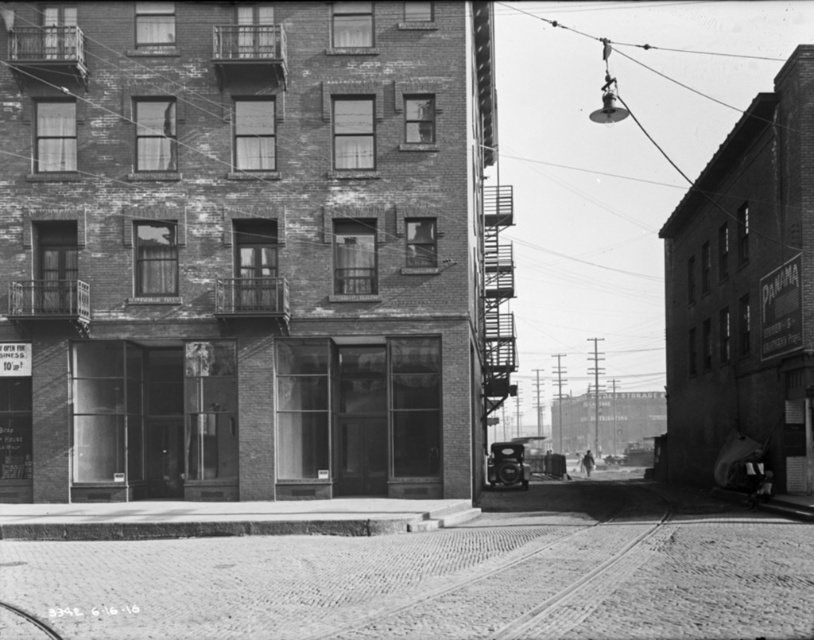
You are a pedestrian standing on the sidewalk in the image. You notice a metallic car at center located at point (506,465). Is there any obstruction between you and the metallic car at center?

The metallic car at center is located at point (506,465), which is the center of the image. Since the street in front of the building is paved with cobblestones and tram tracks run parallel to the sidewalk, there might be tram tracks between you and the metallic car at center. However, the description does not mention any other objects obstructing the path, so it is possible that there is no obstruction besides the tram tracks. But since tram tracks are part of the street infrastructure, they are not ob

You are standing at the point with coordinates point (589, 452) and want to walk to the point with coordinates point (523, 470). Which direction should you face to move towards your destination?

You should face towards the direction of the point (523, 470), which is in front of point (589, 452), so you need to move forward in that direction.

You are a city planner reviewing this historical image for a preservation project. You need to determine if the metallic car at center can be moved past the dark gray fabric man at center without any adjustments. Based on their sizes, can the car be moved around the man?

The metallic car at center occupies less space than the dark gray fabric man at center, so the car can be moved around the man without needing adjustments.